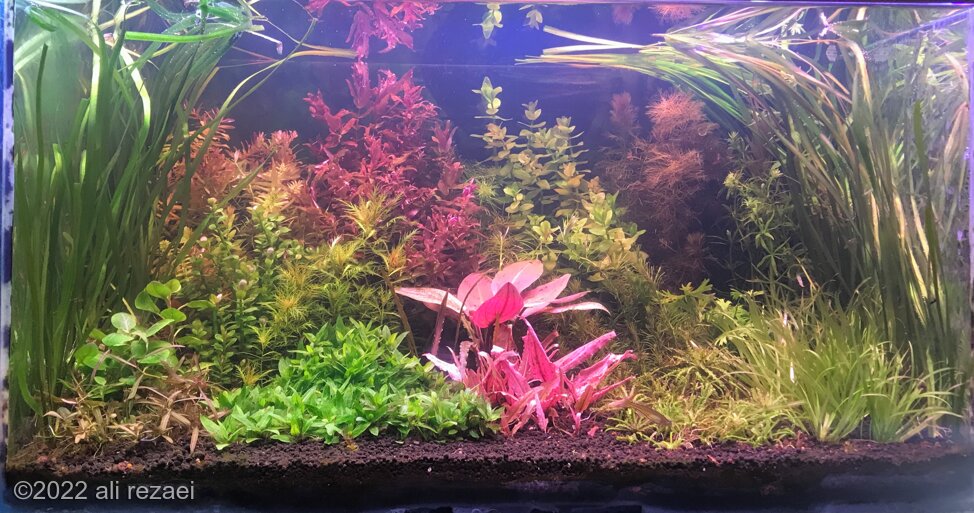
Find the location of a particular element. The image size is (974, 513). back wall of aquarium is located at coordinates (281, 110).